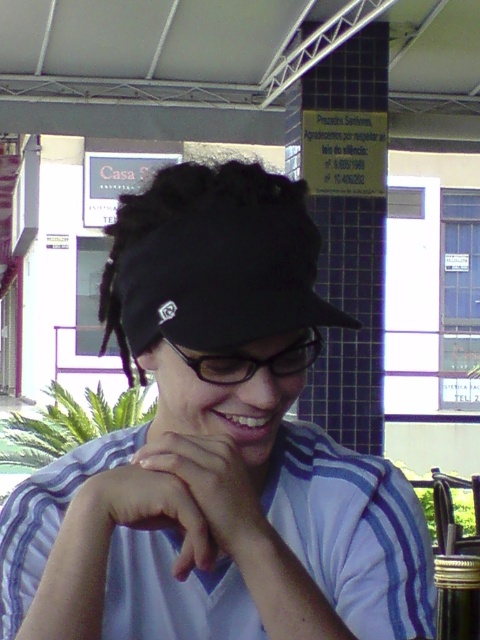
Can you confirm if white matte baseball cap at center is bigger than white matte hand at center?

Yes, white matte baseball cap at center is bigger than white matte hand at center.

What are the coordinates of `white matte baseball cap at center` in the screenshot? It's located at (215, 451).

Describe the element at coordinates (215, 451) in the screenshot. This screenshot has height=640, width=480. I see `white matte baseball cap at center` at that location.

Find the location of a particular element. white matte baseball cap at center is located at coordinates (215, 451).

Is white matte baseball cap at center smaller than black plastic glasses at center?

No.

Between point (139, 612) and point (296, 356), which one is positioned behind?

Point (139, 612)

Identify the location of white matte baseball cap at center. 215,451.

Who is positioned more to the left, white matte baseball cap at center or white striped polo shirt at center?

white matte baseball cap at center is more to the left.

Does point (142, 243) lie in front of point (171, 595)?

Yes, it is.

Is point (47, 620) behind point (23, 525)?

No, (47, 620) is in front of (23, 525).

Where is `white matte baseball cap at center`? Image resolution: width=480 pixels, height=640 pixels. white matte baseball cap at center is located at coordinates pos(215,451).